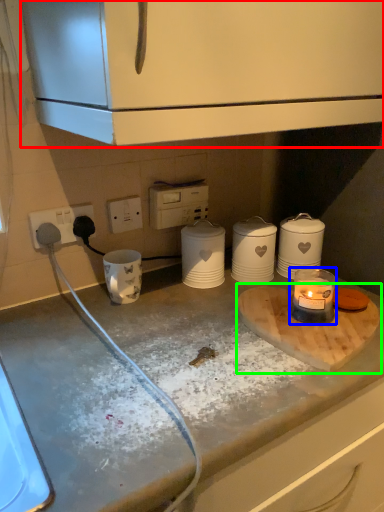
Question: Considering the real-world distances, which object is closest to cabinetry (highlighted by a red box)? candle holder (highlighted by a blue box) or cutting board (highlighted by a green box).

Choices:
 (A) candle holder
 (B) cutting board

Answer: (A)